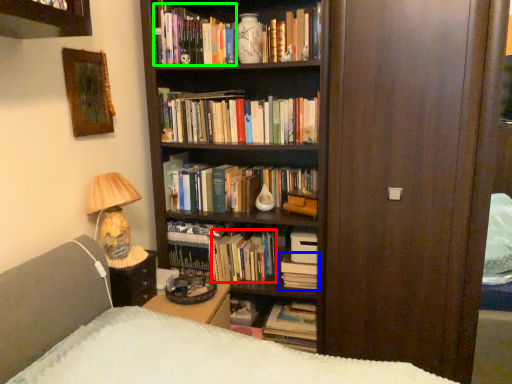
Question: Which object is the closest to the book (highlighted by a red box)? Choose among these: book (highlighted by a blue box) or book (highlighted by a green box).

Choices:
 (A) book
 (B) book

Answer: (A)